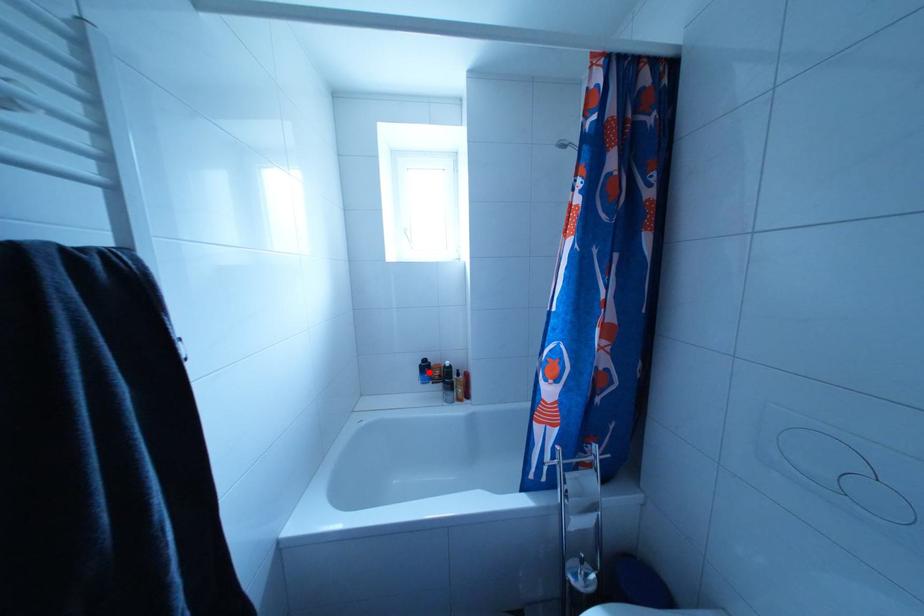
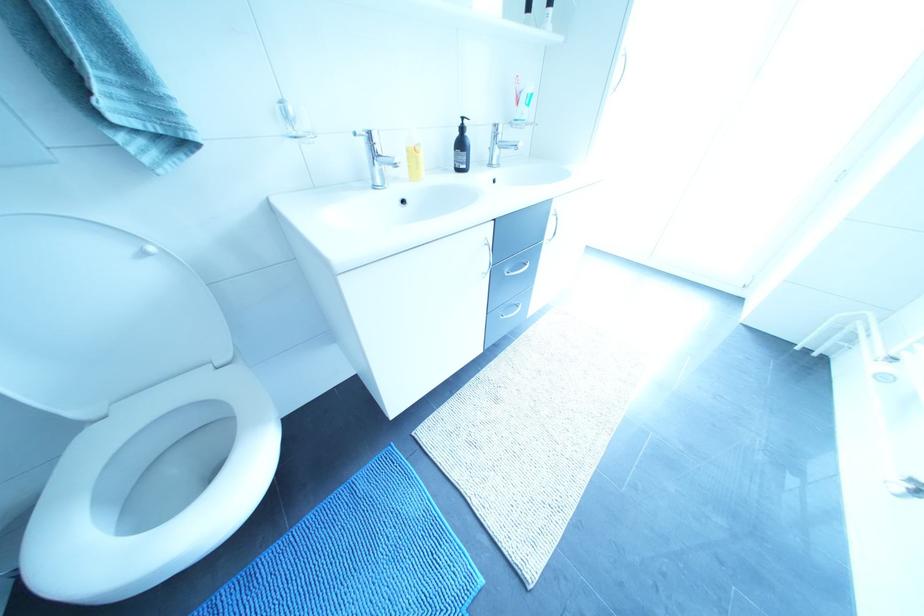
Question: I am providing you with two images of the same scene from different viewpoints. A red point is marked on the first image. Can you still see the location of the red point in image 2?

Choices:
 (A) Yes
 (B) No

Answer: (B)